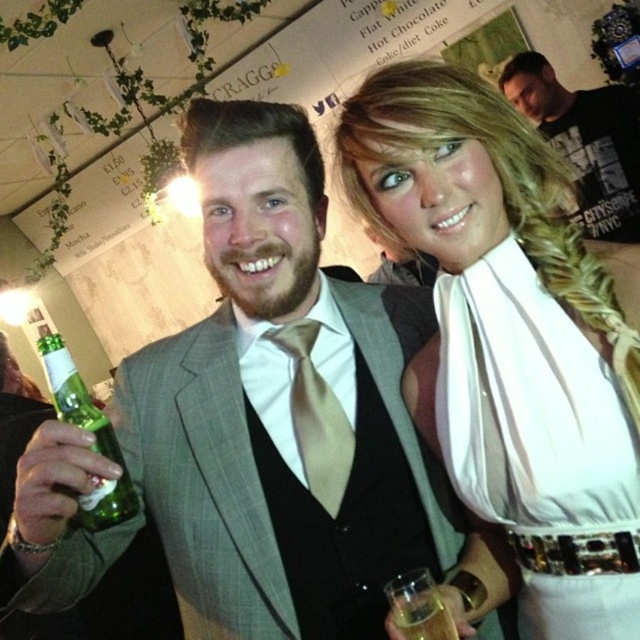
You are a bartender at the bar and need to place the satin beige tie at center and the translucent glass at lower center on a shelf. The shelf can only hold items that are smaller than 15 cm in height. Can both items fit on the shelf?

The satin beige tie at center has a larger size compared to the translucent glass at lower center. However, since the shelf requires items to be smaller than 15 cm in height, and the tie is larger than the glass, but we don not know their exact heights, it is impossible to determine if both items will fit without more information.

You are standing at the origin point of the coordinate system in the image. The white satin dress at upper right is located at point 0.636, 0.828. If you want to move towards it, in which direction should you move?

To move towards the white satin dress at upper right located at coordinates (529, 406), you should move in the positive x and positive y direction since the dress is at a higher x and y coordinate than the origin.